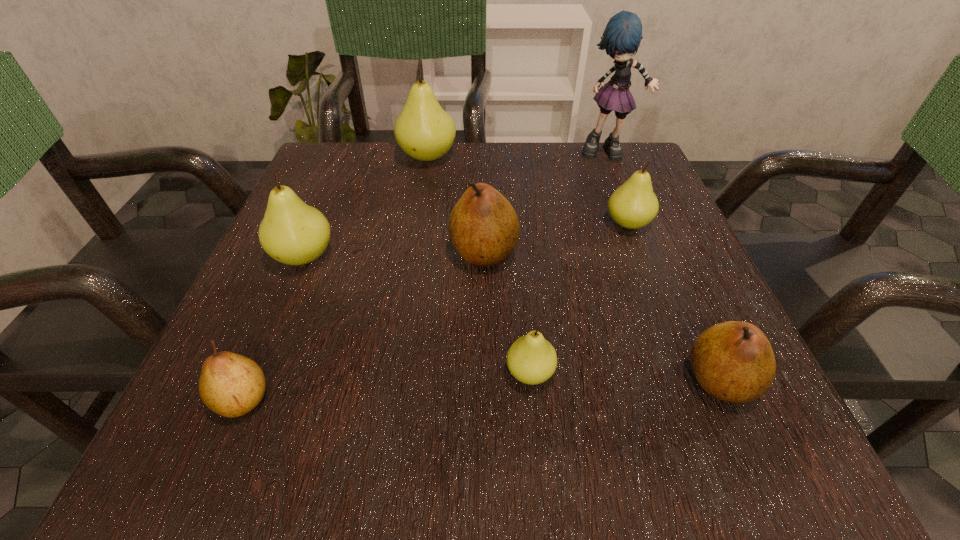
Where is `free space between the farthest green pear and the second biggest brown pear`? The image size is (960, 540). free space between the farthest green pear and the second biggest brown pear is located at coordinates (574, 269).

Find the location of a particular element. vacant space in between the third smallest green pear and the biggest brown pear is located at coordinates (394, 254).

Locate an element on the screen. the fifth closest object relative to the third smallest green pear is located at coordinates pyautogui.click(x=633, y=205).

Identify which object is located as the third nearest to the smallest brown pear. Please provide its 2D coordinates. Your answer should be formatted as a tuple, i.e. [(x, y)], where the tuple contains the x and y coordinates of a point satisfying the conditions above.

[(531, 359)]

Choose which pear is the second nearest neighbor to the biggest green pear. Please provide its 2D coordinates. Your answer should be formatted as a tuple, i.e. [(x, y)], where the tuple contains the x and y coordinates of a point satisfying the conditions above.

[(291, 232)]

Locate which pear is the sixth closest to the tallest pear. Please provide its 2D coordinates. Your answer should be formatted as a tuple, i.e. [(x, y)], where the tuple contains the x and y coordinates of a point satisfying the conditions above.

[(733, 361)]

Image resolution: width=960 pixels, height=540 pixels. Find the location of `green pear that is the second closest to the third biggest green pear`. green pear that is the second closest to the third biggest green pear is located at coordinates (424, 131).

Locate an element on the screen. green pear that stands as the second closest to the leftmost brown pear is located at coordinates (531, 359).

Locate which brown pear ranks second in proximity to the rag doll. Please provide its 2D coordinates. Your answer should be formatted as a tuple, i.e. [(x, y)], where the tuple contains the x and y coordinates of a point satisfying the conditions above.

[(733, 361)]

Select which brown pear appears as the second closest to the leftmost brown pear. Please provide its 2D coordinates. Your answer should be formatted as a tuple, i.e. [(x, y)], where the tuple contains the x and y coordinates of a point satisfying the conditions above.

[(733, 361)]